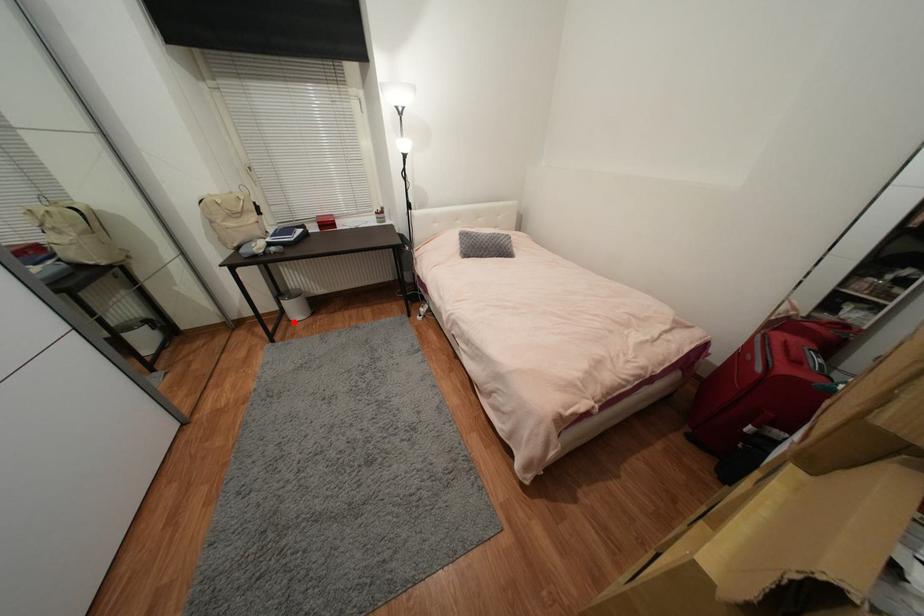
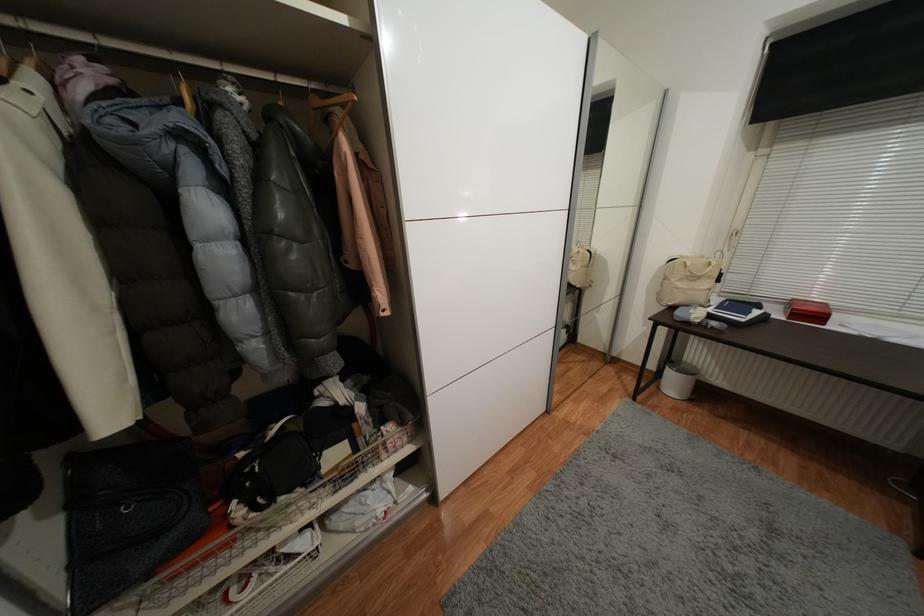
Question: I am providing you with two images of the same scene from different viewpoints. In image1, a red point is highlighted. Considering the same 3D point in image2, which of the following is correct?

Choices:
 (A) It is closer
 (B) It is farther

Answer: (B)